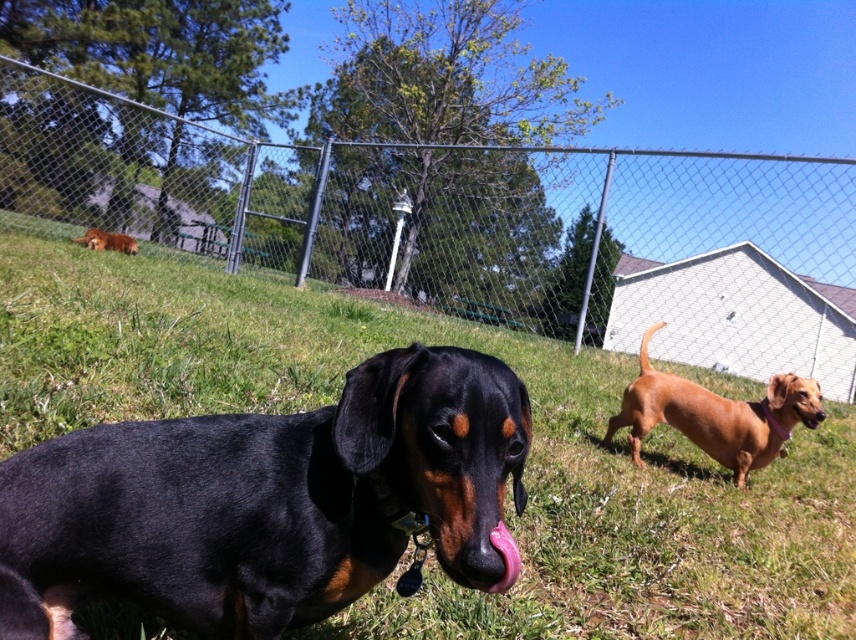
Is green grass at center below black shiny coat at center?

Yes, green grass at center is below black shiny coat at center.

Who is lower down, green grass at center or black shiny coat at center?

green grass at center is below.

Which is in front, point (782, 508) or point (360, 484)?

Point (360, 484) is in front.

In order to click on green grass at center in this screenshot , I will do `click(525, 465)`.

Which is above, green grass at center or smooth brown dog at right?

Positioned higher is smooth brown dog at right.

Can you confirm if green grass at center is shorter than smooth brown dog at right?

Yes, green grass at center is shorter than smooth brown dog at right.

Identify the location of green grass at center. (525, 465).

Is point (229, 205) farther from camera compared to point (498, 584)?

That is True.

Is metal chain-link fence at center bigger than pink rubber tongue at center?

Indeed, metal chain-link fence at center has a larger size compared to pink rubber tongue at center.

Locate an element on the screen. metal chain-link fence at center is located at coordinates (467, 225).